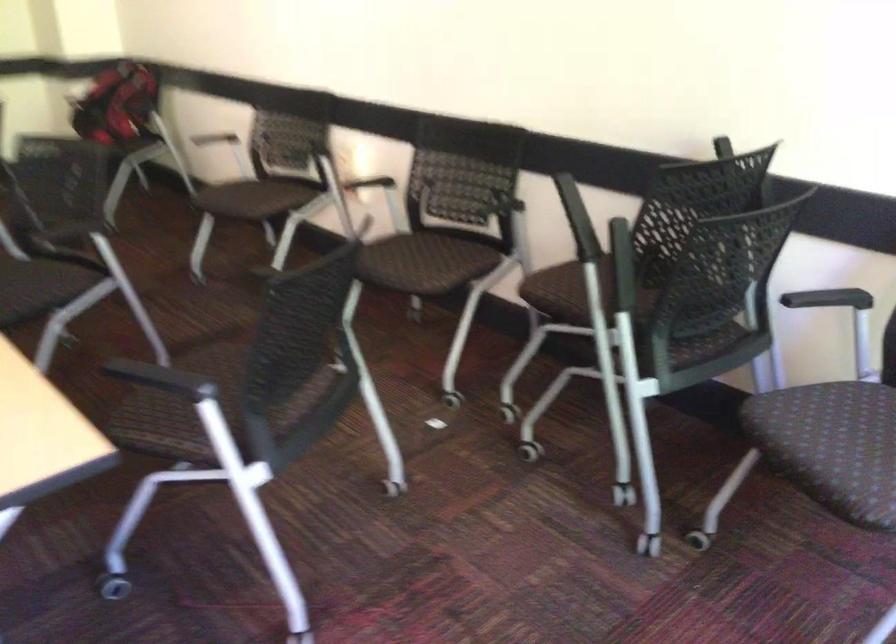
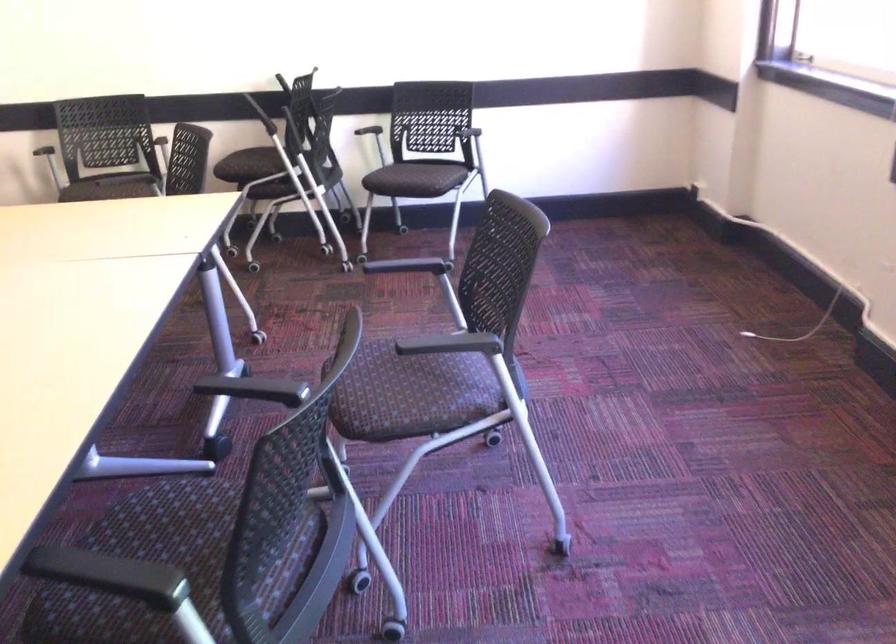
In the second image, find the point that corresponds to (x=394, y=166) in the first image.

(30, 140)